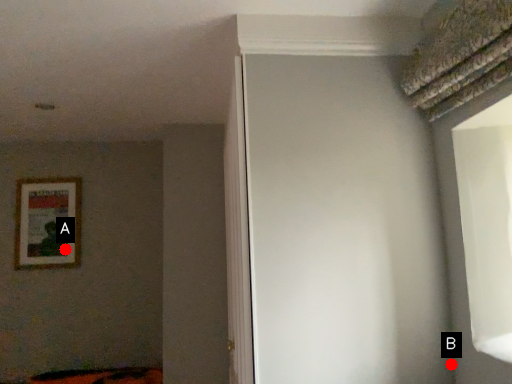
Question: Two points are circled on the image, labeled by A and B beside each circle. Which point is closer to the camera?

Choices:
 (A) A is closer
 (B) B is closer

Answer: (B)